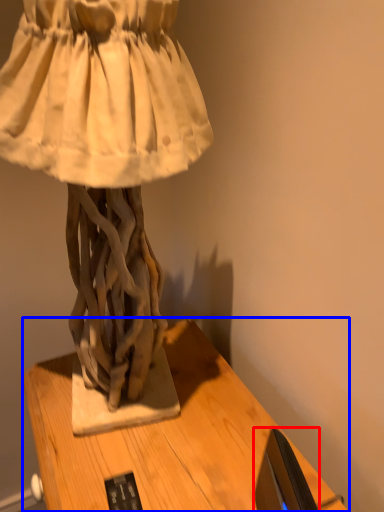
Question: Which object appears closest to the camera in this image, computer monitor (highlighted by a red box) or table (highlighted by a blue box)?

Choices:
 (A) computer monitor
 (B) table

Answer: (A)